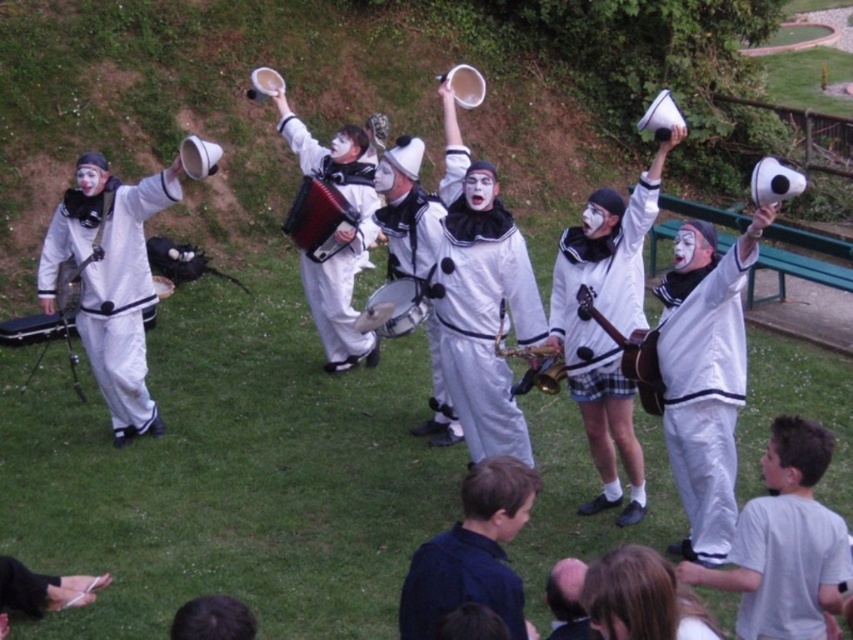
Question: Is white matte clown suit at left wider than dark blue shirt at lower center?

Choices:
 (A) yes
 (B) no

Answer: (A)

Question: Which point appears farthest from the camera in this image?

Choices:
 (A) (328, 320)
 (B) (741, 627)
 (C) (437, 388)
 (D) (415, 301)

Answer: (A)

Question: Does white matte uniform at center appear on the right side of metallic silver drum at center?

Choices:
 (A) yes
 (B) no

Answer: (A)

Question: Which object is closer to the camera taking this photo?

Choices:
 (A) white matte accordion at center
 (B) gray cotton t-shirt at lower right

Answer: (B)

Question: Which object appears closest to the camera in this image?

Choices:
 (A) white matte drum at center
 (B) white matte uniform at center

Answer: (B)

Question: Considering the relative positions of white matte clown suit at left and wooden acoustic guitar at center in the image provided, where is white matte clown suit at left located with respect to wooden acoustic guitar at center?

Choices:
 (A) above
 (B) below

Answer: (A)